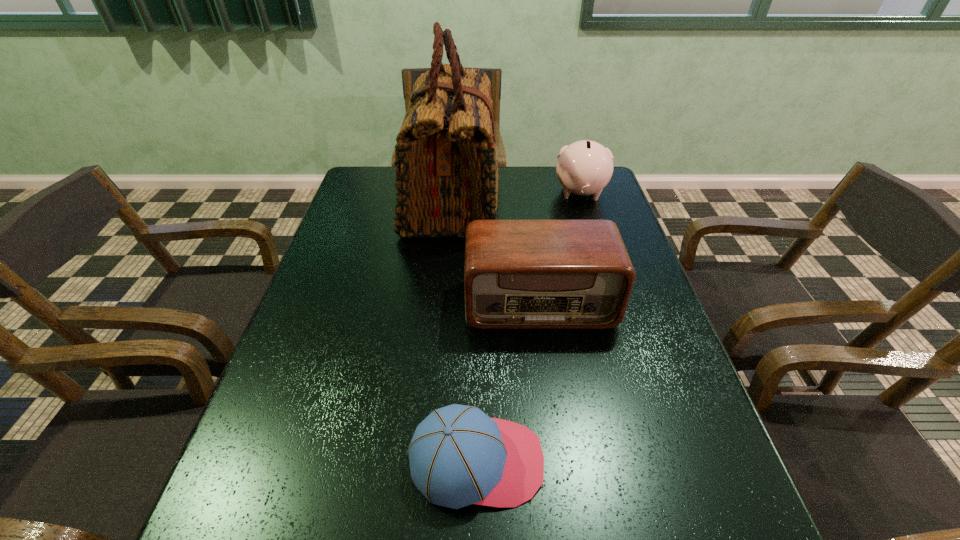
At what (x,y) coordinates should I click in order to perform the action: click on piggy bank at the far edge. Please return your answer as a coordinate pair (x, y). The width and height of the screenshot is (960, 540). Looking at the image, I should click on (585, 167).

What are the coordinates of `radio receiver located at the right edge` in the screenshot? It's located at (518, 274).

The width and height of the screenshot is (960, 540). Find the location of `piggy bank that is at the right edge`. piggy bank that is at the right edge is located at coordinates (585, 167).

At what (x,y) coordinates should I click in order to perform the action: click on object positioned at the far right corner. Please return your answer as a coordinate pair (x, y). This screenshot has height=540, width=960. Looking at the image, I should click on (585, 167).

Where is `vacant space at the far edge of the desktop`? vacant space at the far edge of the desktop is located at coordinates (557, 198).

At what (x,y) coordinates should I click in order to perform the action: click on free space at the near edge. Please return your answer as a coordinate pair (x, y). Image resolution: width=960 pixels, height=540 pixels. Looking at the image, I should click on (392, 528).

In the image, there is a desktop. Where is `vacant space at the left edge`? The width and height of the screenshot is (960, 540). vacant space at the left edge is located at coordinates point(264,438).

This screenshot has width=960, height=540. In the image, there is a desktop. In order to click on vacant space at the right edge in this screenshot , I will do `click(586, 206)`.

Where is `free space at the far left corner`? free space at the far left corner is located at coordinates (390, 168).

This screenshot has height=540, width=960. I want to click on empty location between the nearest object and the second nearest object, so click(x=508, y=382).